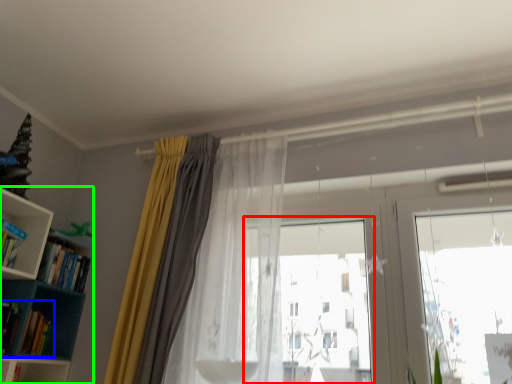
Question: Considering the real-world distances, which object is farthest from bay window (highlighted by a red box)? book (highlighted by a blue box) or bookcase (highlighted by a green box)?

Choices:
 (A) book
 (B) bookcase

Answer: (A)